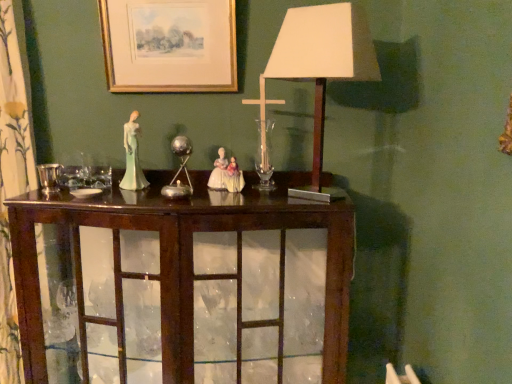
Locate an element on the screen. This screenshot has height=384, width=512. space that is in front of shiny silver candle holder at left, the first candle holder viewed from the left is located at coordinates (33, 200).